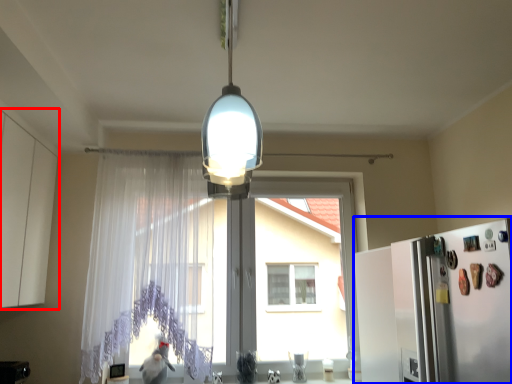
Question: Among these objects, which one is farthest to the camera, cabinetry (highlighted by a red box) or fridge (highlighted by a blue box)?

Choices:
 (A) cabinetry
 (B) fridge

Answer: (A)